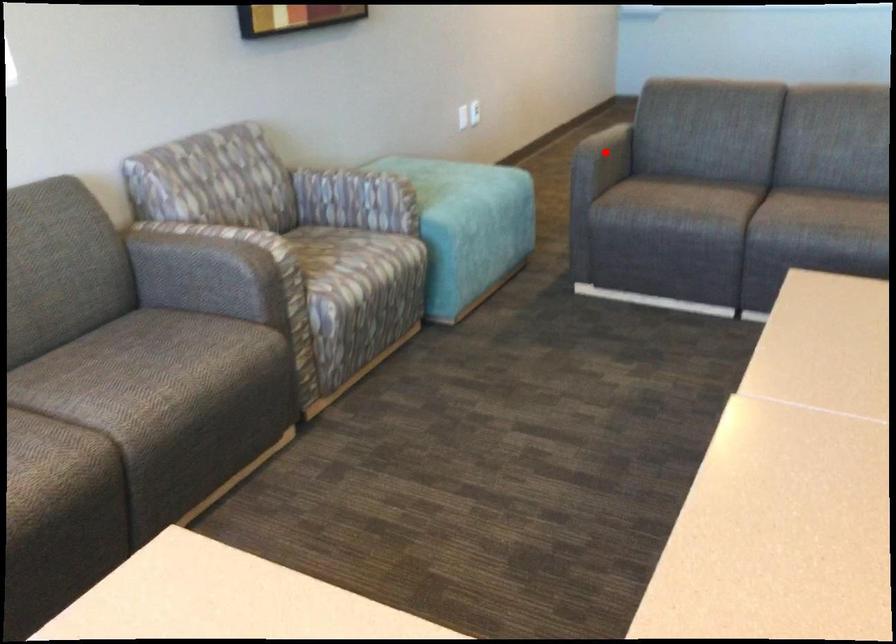
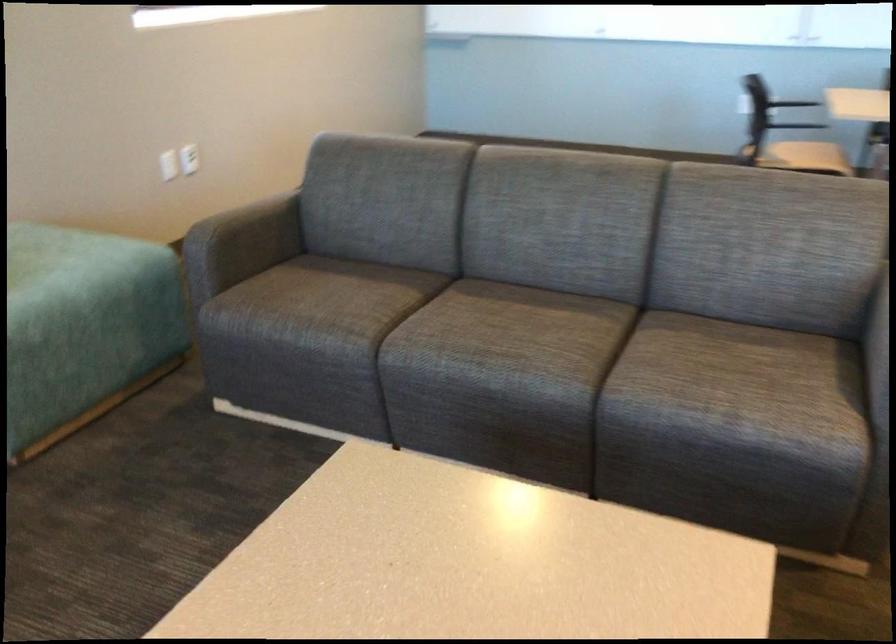
Locate, in the second image, the point that corresponds to the highlighted location in the first image.

(243, 240)